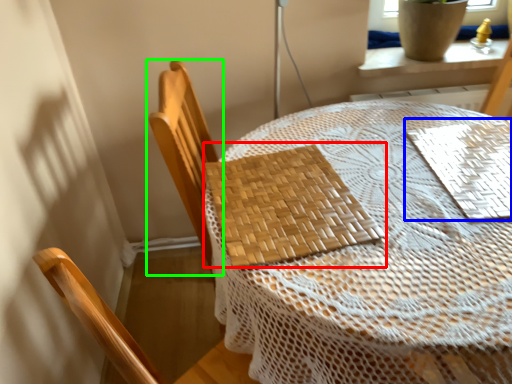
Question: Based on their relative distances, which object is nearer to mat (highlighted by a red box)? Choose from mat (highlighted by a blue box) and chair (highlighted by a green box).

Choices:
 (A) mat
 (B) chair

Answer: (B)